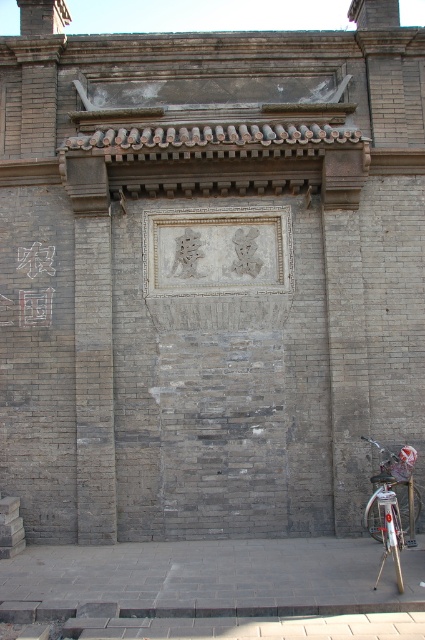
Question: Does dark gray stone pavement at lower center appear under dark brown stone sign at upper center?

Choices:
 (A) no
 (B) yes

Answer: (B)

Question: Can you confirm if white stone plaque at center is bigger than dark brown stone sign at upper center?

Choices:
 (A) yes
 (B) no

Answer: (A)

Question: Which is farther from the dark gray stone pavement at lower center?

Choices:
 (A) white stone plaque at center
 (B) silver metallic bicycle at lower right

Answer: (A)

Question: Which point is farther to the camera?

Choices:
 (A) (124, 580)
 (B) (390, 468)

Answer: (B)

Question: Is dark gray stone pavement at lower center closer to the viewer compared to silver metallic bicycle at lower right?

Choices:
 (A) no
 (B) yes

Answer: (B)

Question: Which of these objects is positioned farthest from the silver metallic bicycle at lower right?

Choices:
 (A) dark brown stone sign at upper center
 (B) dark gray stone pavement at lower center

Answer: (A)